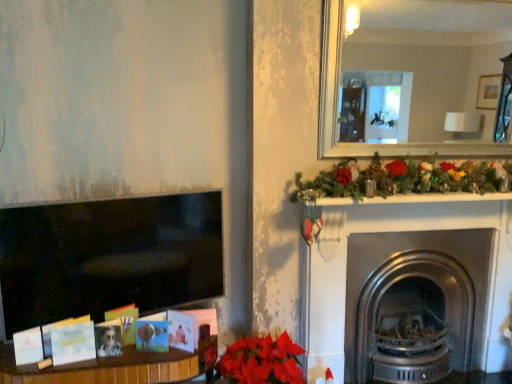
Question: In terms of width, does stainless steel fireplace at right look wider or thinner when compared to vibrant matte poinsettia at lower center?

Choices:
 (A) wide
 (B) thin

Answer: (B)

Question: Choose the correct answer: Is stainless steel fireplace at right inside vibrant matte poinsettia at lower center or outside it?

Choices:
 (A) inside
 (B) outside

Answer: (B)

Question: In terms of size, does stainless steel fireplace at right appear bigger or smaller than vibrant matte poinsettia at lower center?

Choices:
 (A) small
 (B) big

Answer: (B)

Question: Considering the positions of point (266, 349) and point (338, 248), is point (266, 349) closer or farther from the camera than point (338, 248)?

Choices:
 (A) closer
 (B) farther

Answer: (A)

Question: Considering the positions of vibrant matte poinsettia at lower center and stainless steel fireplace at right in the image, is vibrant matte poinsettia at lower center taller or shorter than stainless steel fireplace at right?

Choices:
 (A) tall
 (B) short

Answer: (B)

Question: Is vibrant matte poinsettia at lower center bigger or smaller than stainless steel fireplace at right?

Choices:
 (A) big
 (B) small

Answer: (B)

Question: From a real-world perspective, is vibrant matte poinsettia at lower center physically located above or below stainless steel fireplace at right?

Choices:
 (A) above
 (B) below

Answer: (B)